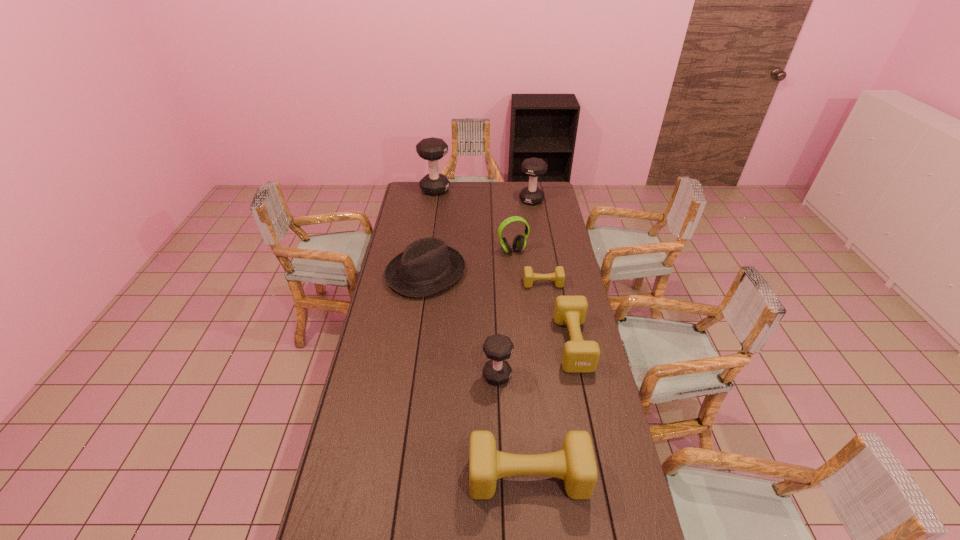
At what (x,y) coordinates should I click in order to perform the action: click on the second biggest olive dumbbell. Please return your answer as a coordinate pair (x, y). The height and width of the screenshot is (540, 960). Looking at the image, I should click on (579, 356).

Identify the location of the second nearest olive dumbbell. The width and height of the screenshot is (960, 540). (579, 356).

You are a GUI agent. You are given a task and a screenshot of the screen. Output one action in this format:
    pyautogui.click(x=<x>, y=<y>)
    Task: Click on the shortest dumbbell
    The height and width of the screenshot is (540, 960).
    Given the screenshot: What is the action you would take?
    pyautogui.click(x=558, y=276)

Locate an element on the screen. The width and height of the screenshot is (960, 540). the smallest olive dumbbell is located at coordinates (558, 276).

You are a GUI agent. You are given a task and a screenshot of the screen. Output one action in this format:
    pyautogui.click(x=<x>, y=<y>)
    Task: Click on the vacant space located on the front of the leftmost dumbbell
    The width and height of the screenshot is (960, 540).
    Given the screenshot: What is the action you would take?
    pyautogui.click(x=431, y=215)

This screenshot has height=540, width=960. Find the location of `free spot located on the front of the seventh shortest object`. free spot located on the front of the seventh shortest object is located at coordinates (535, 219).

Locate an element on the screen. The image size is (960, 540). vacant region located on the left of the headset is located at coordinates (429, 251).

The image size is (960, 540). I want to click on blank space located on the back of the smallest gray dumbbell, so click(495, 315).

Image resolution: width=960 pixels, height=540 pixels. Identify the location of free point located 0.260m on the front of the gray fedora. (416, 346).

At what (x,y) coordinates should I click in order to perform the action: click on vacant space located 0.280m on the back of the nearest dumbbell. Please return your answer as a coordinate pair (x, y). This screenshot has width=960, height=540. Looking at the image, I should click on (520, 381).